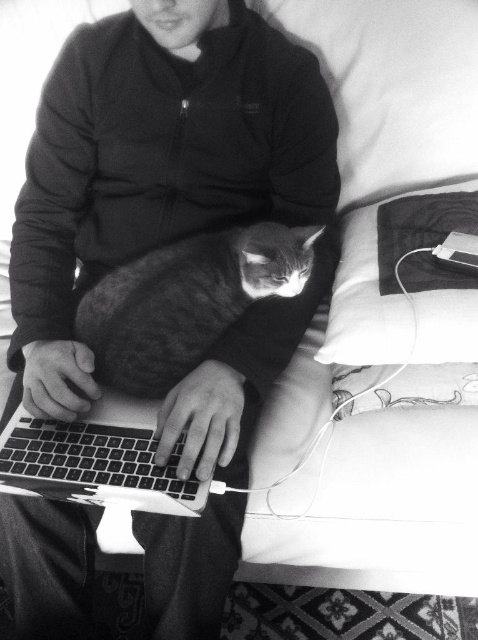
Which is behind, point (386, 301) or point (433, 312)?

The point (386, 301) is more distant.

Does white soft pillow at upper right have a greater width compared to soft fabric pillow at upper right?

Yes.

This screenshot has height=640, width=478. Describe the element at coordinates (372, 182) in the screenshot. I see `white soft pillow at upper right` at that location.

You are a GUI agent. You are given a task and a screenshot of the screen. Output one action in this format:
    pyautogui.click(x=<x>, y=<y>)
    Task: Click on the white soft pillow at upper right
    
    Given the screenshot: What is the action you would take?
    pyautogui.click(x=372, y=182)

Who is positioned more to the left, white soft pillow at upper right or black matte keyboard at center?

From the viewer's perspective, black matte keyboard at center appears more on the left side.

Does white soft pillow at upper right have a greater width compared to black matte keyboard at center?

Yes.

Which is in front, point (251, 484) or point (51, 422)?

Point (51, 422) is in front.

At what (x,y) coordinates should I click in order to perform the action: click on white soft pillow at upper right. Please return your answer as a coordinate pair (x, y). This screenshot has height=640, width=478. Looking at the image, I should click on (372, 182).

Does metallic silver laptop at center have a greater width compared to gray striped cat at center?

Yes.

Does metallic silver laptop at center appear over gray striped cat at center?

Actually, metallic silver laptop at center is below gray striped cat at center.

Between point (139, 339) and point (170, 348), which one is positioned in front?

Point (170, 348) is more forward.

In order to click on metallic silver laptop at center in this screenshot , I will do `click(187, 298)`.